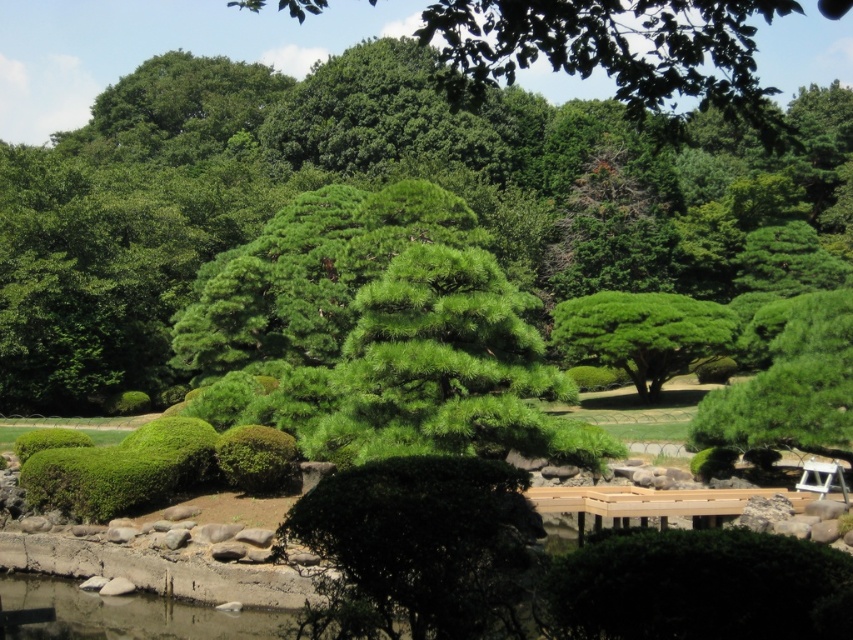
Question: Which object is positioned closest to the dark green textured bush at center?

Choices:
 (A) green fuzzy bush at center
 (B) green textured bush at center

Answer: (A)

Question: Does green textured bush at center appear on the left side of green fuzzy bush at center?

Choices:
 (A) yes
 (B) no

Answer: (B)

Question: Which object is farther from the camera taking this photo?

Choices:
 (A) green fuzzy bush at center
 (B) dark green textured bush at lower center
 (C) dark green textured bush at center
 (D) green textured bush at center

Answer: (D)

Question: Which object is the closest to the green fuzzy bush at center?

Choices:
 (A) green textured bush at center
 (B) dark green textured bush at center
 (C) dark green textured bush at lower center

Answer: (B)

Question: Does dark green textured bush at center appear over green textured bush at center?

Choices:
 (A) no
 (B) yes

Answer: (A)

Question: Is dark green textured bush at center behind green textured bush at center?

Choices:
 (A) yes
 (B) no

Answer: (B)